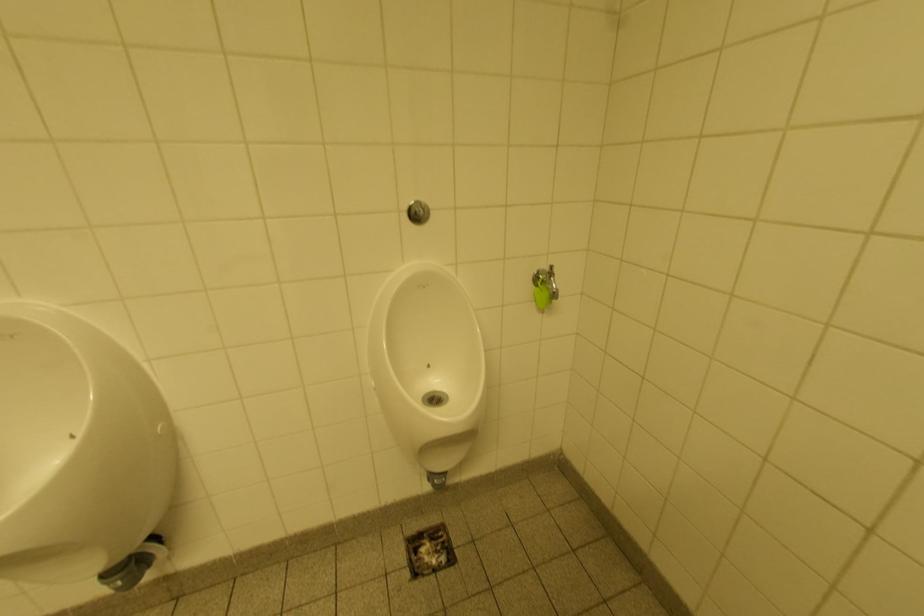
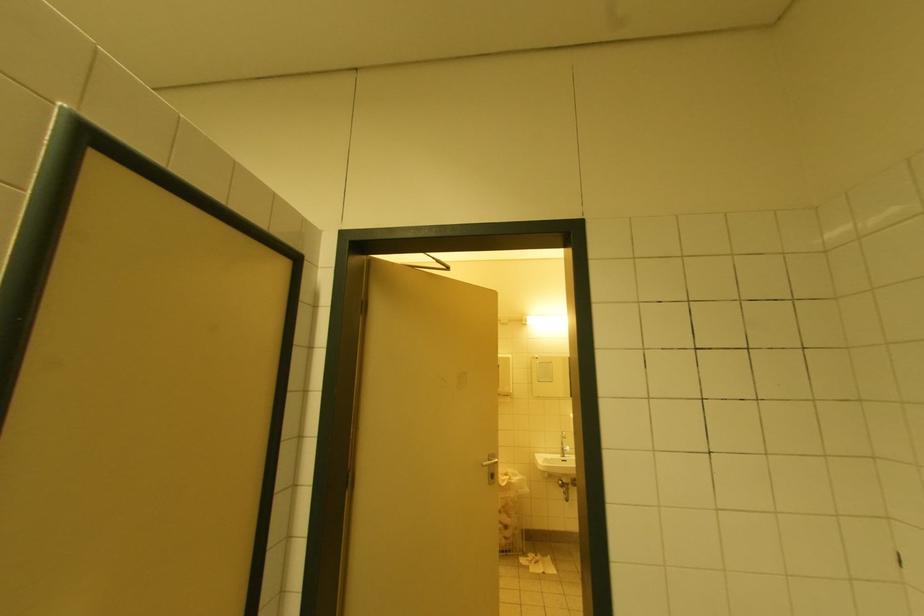
Question: The images are taken continuously from a first-person perspective. In which direction is your viewpoint rotating?

Choices:
 (A) Left
 (B) Right
 (C) Up
 (D) Down

Answer: (A)